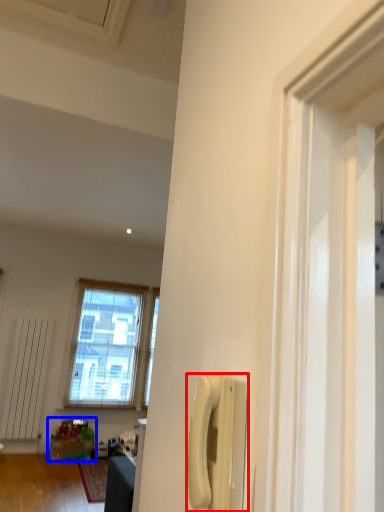
Question: Which object is closer to the camera taking this photo, corded phone (highlighted by a red box) or toy (highlighted by a blue box)?

Choices:
 (A) corded phone
 (B) toy

Answer: (A)